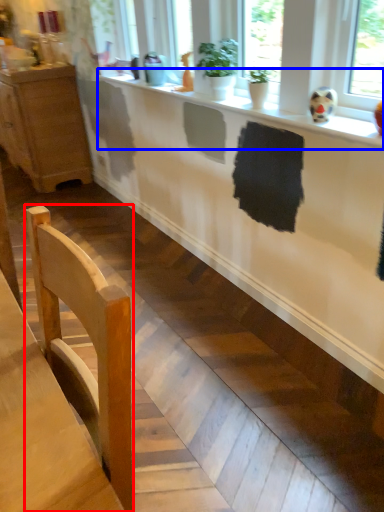
Question: Among these objects, which one is nearest to the camera, chair (highlighted by a red box) or counter top (highlighted by a blue box)?

Choices:
 (A) chair
 (B) counter top

Answer: (A)